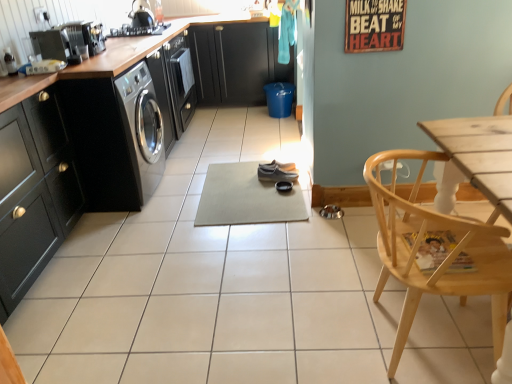
Question: Is beige rubber yoga mat at center placed right next to matte black cabinets at center, acting as the second cabinetry starting from the bottom?

Choices:
 (A) no
 (B) yes

Answer: (A)

Question: Is beige rubber yoga mat at center closer to the viewer compared to matte black cabinets at center, acting as the second cabinetry starting from the bottom?

Choices:
 (A) no
 (B) yes

Answer: (B)

Question: From a real-world perspective, is beige rubber yoga mat at center below matte black cabinets at center, acting as the second cabinetry starting from the bottom?

Choices:
 (A) no
 (B) yes

Answer: (B)

Question: Can you confirm if beige rubber yoga mat at center is wider than matte black cabinets at center, positioned as the 2th cabinetry in left-to-right order?

Choices:
 (A) yes
 (B) no

Answer: (A)

Question: Is beige rubber yoga mat at center turned away from matte black cabinets at center, positioned as the 1th cabinetry in top-to-bottom order?

Choices:
 (A) yes
 (B) no

Answer: (A)

Question: Considering the positions of light wood chair at lower right and matte black cabinet at left, marked as the 1th cabinetry in a bottom-to-top arrangement, in the image, is light wood chair at lower right wider or thinner than matte black cabinet at left, marked as the 1th cabinetry in a bottom-to-top arrangement,?

Choices:
 (A) wide
 (B) thin

Answer: (B)

Question: In the image, is light wood chair at lower right positioned in front of or behind matte black cabinet at left, acting as the second cabinetry starting from the top?

Choices:
 (A) behind
 (B) front

Answer: (B)

Question: Looking at the image, does light wood chair at lower right seem bigger or smaller compared to matte black cabinet at left, acting as the second cabinetry starting from the top?

Choices:
 (A) big
 (B) small

Answer: (B)

Question: Is point (485, 273) positioned closer to the camera than point (31, 198)?

Choices:
 (A) farther
 (B) closer

Answer: (B)

Question: Considering the positions of light wood chair at lower right and beige rubber yoga mat at center in the image, is light wood chair at lower right bigger or smaller than beige rubber yoga mat at center?

Choices:
 (A) big
 (B) small

Answer: (A)

Question: Would you say light wood chair at lower right is to the left or to the right of beige rubber yoga mat at center in the picture?

Choices:
 (A) left
 (B) right

Answer: (B)

Question: Is light wood chair at lower right wider or thinner than beige rubber yoga mat at center?

Choices:
 (A) thin
 (B) wide

Answer: (A)

Question: From a real-world perspective, is light wood chair at lower right physically located above or below beige rubber yoga mat at center?

Choices:
 (A) below
 (B) above

Answer: (B)

Question: Is matte black cabinet at left, arranged as the 2th cabinetry when viewed from the right, to the left or to the right of matte gray shoe at center in the image?

Choices:
 (A) left
 (B) right

Answer: (A)

Question: In terms of height, does matte black cabinet at left, marked as the 1th cabinetry in a bottom-to-top arrangement, look taller or shorter compared to matte gray shoe at center?

Choices:
 (A) tall
 (B) short

Answer: (A)